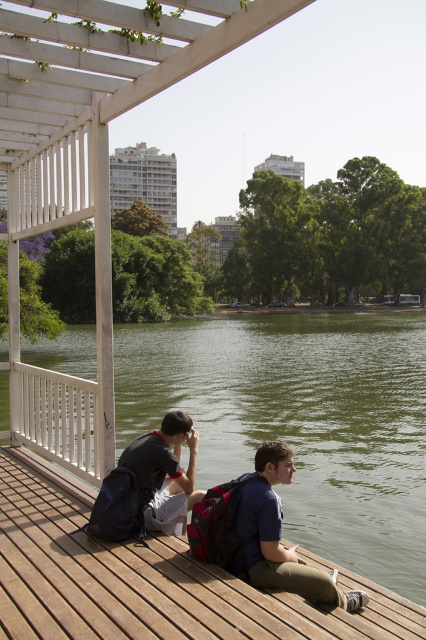
Based on the scene description, where is the wooden at center located in terms of coordinates?

The wooden at center is located at point (149, 579).

You are a delivery robot with a package that needs to be placed between the wooden at center and the dark gray backpack at lower left. The minimum distance required for the package to fit is 70 centimeters. Can you place the package there?

The wooden at center and dark gray backpack at lower left are 76.85 centimeters apart, which is more than the required 70 centimeters. Therefore, the package can be placed between them.

You are planning to place a dark gray backpack at lower left on the wooden at center. Considering their sizes, will the backpack fit entirely on the wooden surface?

The wooden at center has a larger width than the dark gray backpack at lower left, so the backpack will fit entirely on the wooden surface.